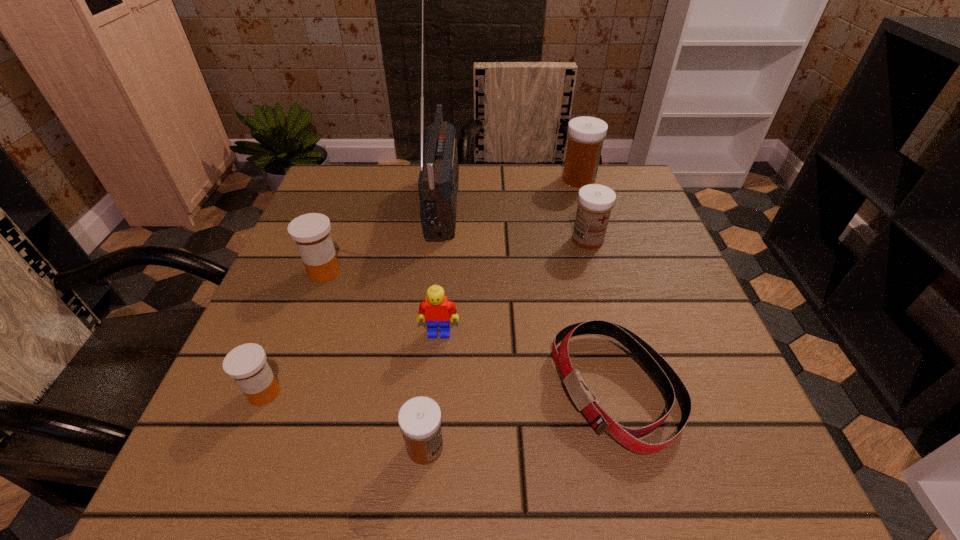
Locate an element on the screen. The height and width of the screenshot is (540, 960). vacant space at the near edge is located at coordinates (385, 436).

This screenshot has width=960, height=540. In the image, there is a desktop. What are the coordinates of `vacant space at the left edge` in the screenshot? It's located at (294, 295).

In order to click on vacant space at the right edge of the desktop in this screenshot , I will do `click(610, 262)`.

Locate an element on the screen. The height and width of the screenshot is (540, 960). vacant space at the far left corner is located at coordinates (381, 168).

The width and height of the screenshot is (960, 540). Identify the location of free region at the near right corner. (672, 467).

Identify the location of free point between the leftmost white medicine and the bigger orange medicine. click(374, 360).

Find the location of `vacant area between the yellow Lego and the second nearest medicine`. vacant area between the yellow Lego and the second nearest medicine is located at coordinates (351, 363).

In order to click on free space between the tallest object and the nearer orange medicine in this screenshot , I will do `click(354, 297)`.

Locate an element on the screen. The height and width of the screenshot is (540, 960). vacant space that is in between the nearest white medicine and the fourth nearest medicine is located at coordinates (507, 343).

Identify the location of empty location between the tallest medicine and the yellow Lego. (509, 256).